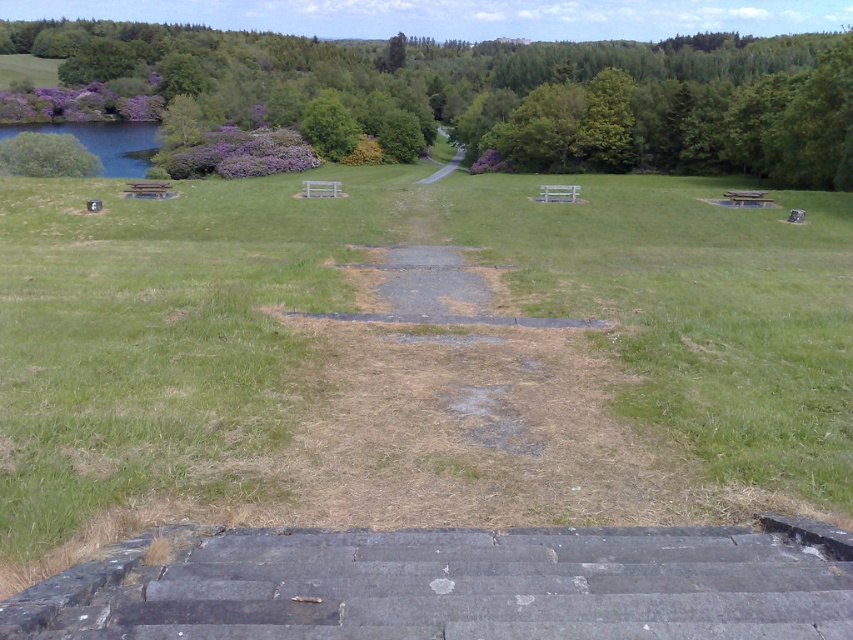
Question: Is purple leafy tree at upper left closer to camera compared to green leafy tree at upper left?

Choices:
 (A) yes
 (B) no

Answer: (A)

Question: Which object is farther from the camera taking this photo?

Choices:
 (A) dark gray stone stairs at lower center
 (B) purple leafy tree at upper left
 (C) gravel path at center

Answer: (C)

Question: Is green leafy tree at upper left behind gravel path at center?

Choices:
 (A) yes
 (B) no

Answer: (B)

Question: Is dark gray stone stairs at lower center wider than purple leafy tree at upper left?

Choices:
 (A) no
 (B) yes

Answer: (A)

Question: Which object is farther from the camera taking this photo?

Choices:
 (A) dark gray stone stairs at lower center
 (B) purple leafy tree at upper left
 (C) green leafy tree at upper left
 (D) gravel path at center

Answer: (D)

Question: Which is nearer to the gravel path at center?

Choices:
 (A) purple leafy tree at upper left
 (B) dark gray stone stairs at lower center
 (C) green leafy tree at upper left

Answer: (C)